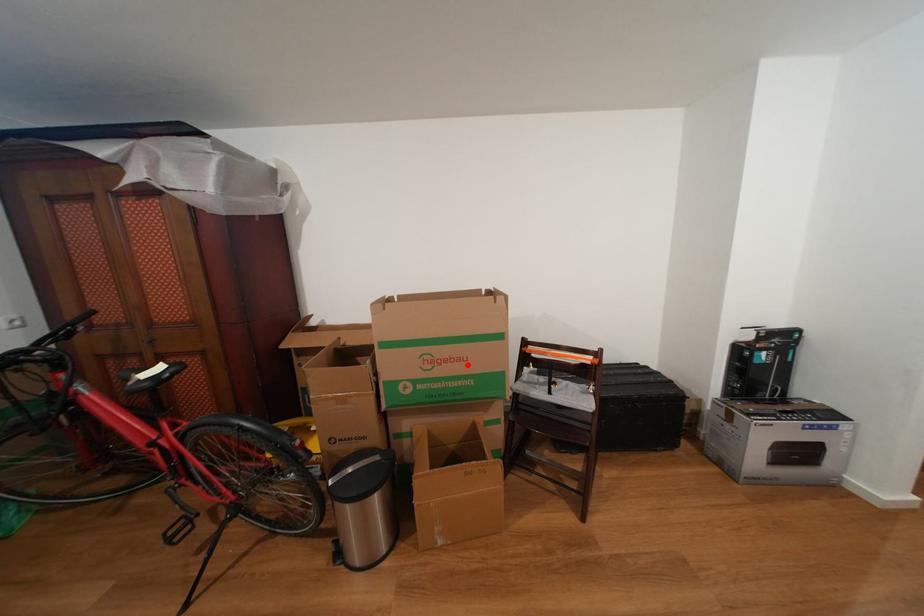
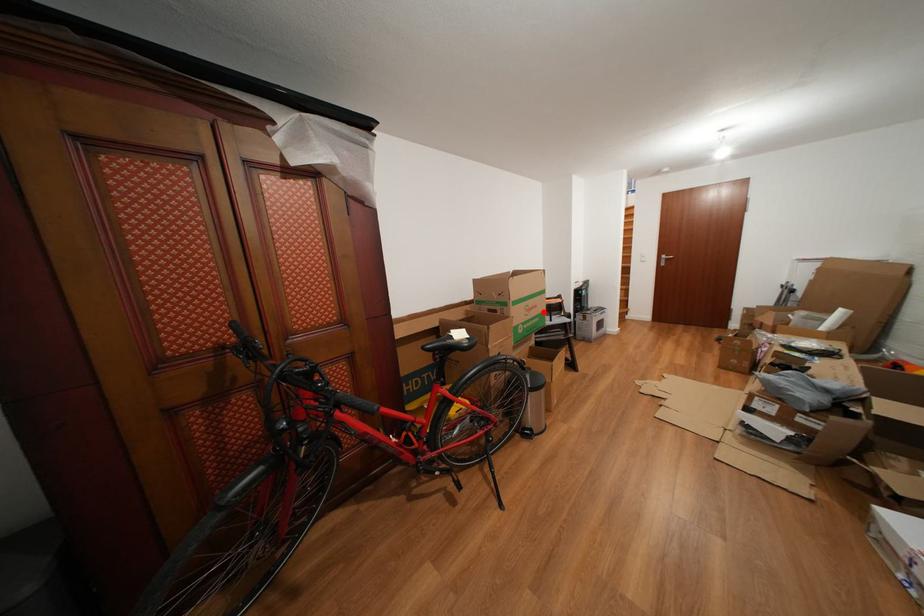
I am providing you with two images of the same scene from different viewpoints. A red point is marked on the first image and another point is marked on the second image. Does the point marked in image1 correspond to the same location as the one in image2?

Yes